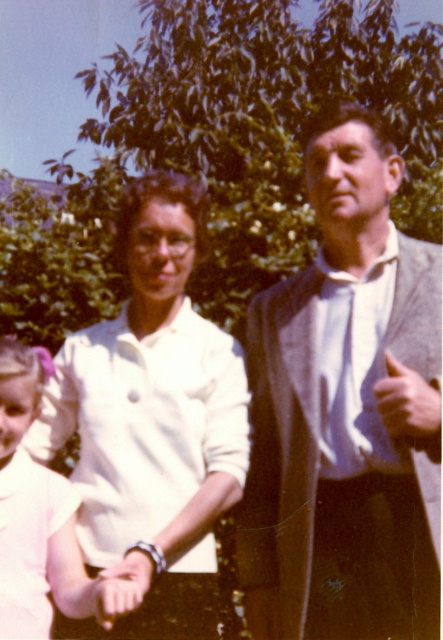
Does white matte shirt at center appear on the left side of smooth leather wristwatch at center?

Correct, you'll find white matte shirt at center to the left of smooth leather wristwatch at center.

Is point (69, 339) positioned before point (112, 614)?

No, it is behind (112, 614).

What are the coordinates of `white matte shirt at center` in the screenshot? It's located at (154, 416).

Does gray wool sweater at right come in front of light pink fabric dress at center?

No, it is behind light pink fabric dress at center.

Is point (388, 625) closer to camera compared to point (62, 483)?

That is True.

The width and height of the screenshot is (443, 640). Describe the element at coordinates (345, 413) in the screenshot. I see `gray wool sweater at right` at that location.

You are a GUI agent. You are given a task and a screenshot of the screen. Output one action in this format:
    pyautogui.click(x=<x>, y=<y>)
    Task: Click on the gray wool sweater at right
    Image resolution: width=443 pixels, height=640 pixels.
    Given the screenshot: What is the action you would take?
    pyautogui.click(x=345, y=413)

Who is more forward, (344, 349) or (136, 556)?

Point (136, 556) is in front.

Can you confirm if gray wool sweater at right is smaller than smooth leather wristwatch at center?

Actually, gray wool sweater at right might be larger than smooth leather wristwatch at center.

This screenshot has width=443, height=640. I want to click on gray wool sweater at right, so click(345, 413).

Locate an element on the screen. gray wool sweater at right is located at coordinates (345, 413).